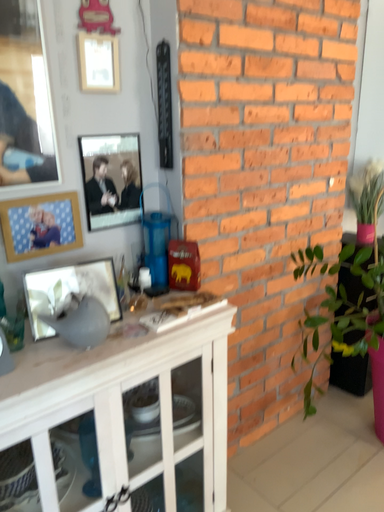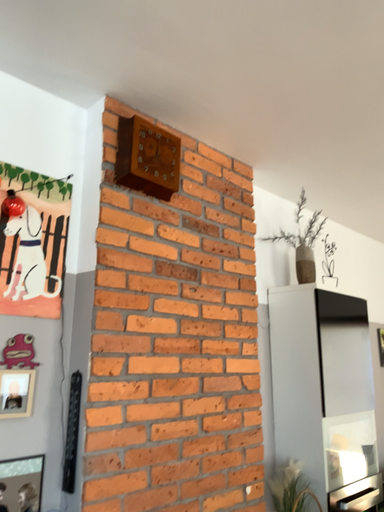
Question: Which way did the camera rotate in the video?

Choices:
 (A) rotated upward
 (B) rotated downward

Answer: (A)